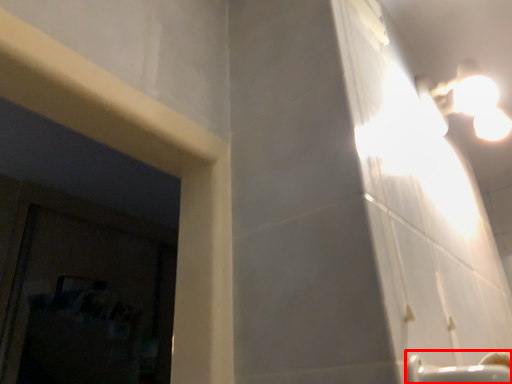
Question: In this image, where is faucet (annotated by the red box) located relative to light fixture?

Choices:
 (A) right
 (B) left

Answer: (B)